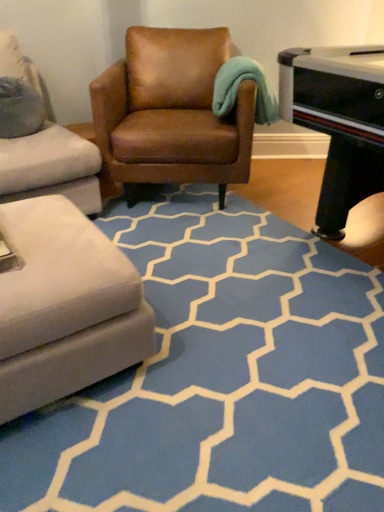
Question: Is the position of blue carpet at center less distant than that of brown leather chair at center?

Choices:
 (A) no
 (B) yes

Answer: (B)

Question: Does blue carpet at center appear on the right side of brown leather chair at center?

Choices:
 (A) yes
 (B) no

Answer: (A)

Question: Considering the relative sizes of blue carpet at center and brown leather chair at center in the image provided, is blue carpet at center bigger than brown leather chair at center?

Choices:
 (A) no
 (B) yes

Answer: (A)

Question: Considering the relative sizes of blue carpet at center and brown leather chair at center in the image provided, is blue carpet at center taller than brown leather chair at center?

Choices:
 (A) yes
 (B) no

Answer: (B)

Question: From a real-world perspective, is blue carpet at center positioned under brown leather chair at center based on gravity?

Choices:
 (A) no
 (B) yes

Answer: (B)

Question: From a real-world perspective, is blue carpet at center on top of brown leather chair at center?

Choices:
 (A) yes
 (B) no

Answer: (B)

Question: Can you confirm if brown leather chair at center is thinner than blue carpet at center?

Choices:
 (A) no
 (B) yes

Answer: (B)

Question: Is brown leather chair at center beside blue carpet at center?

Choices:
 (A) yes
 (B) no

Answer: (B)

Question: Considering the relative positions of brown leather chair at center and blue carpet at center in the image provided, is brown leather chair at center to the right of blue carpet at center from the viewer's perspective?

Choices:
 (A) no
 (B) yes

Answer: (A)

Question: Does brown leather chair at center have a greater width compared to blue carpet at center?

Choices:
 (A) no
 (B) yes

Answer: (A)

Question: Is blue carpet at center inside brown leather chair at center?

Choices:
 (A) yes
 (B) no

Answer: (B)

Question: Considering the relative sizes of brown leather chair at center and blue carpet at center in the image provided, is brown leather chair at center shorter than blue carpet at center?

Choices:
 (A) no
 (B) yes

Answer: (A)

Question: From a real-world perspective, is brown leather chair at center above or below blue carpet at center?

Choices:
 (A) below
 (B) above

Answer: (B)